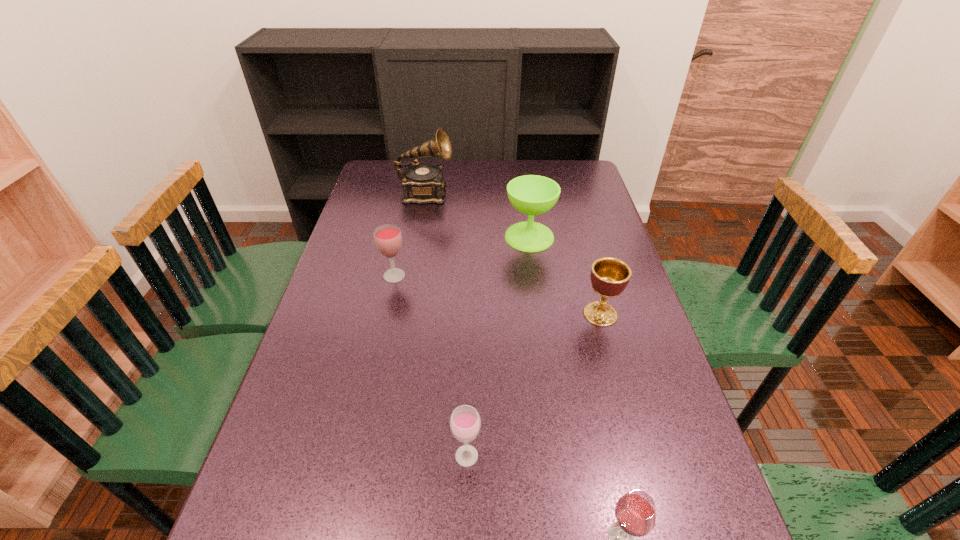
Where is `the tallest object`? The height and width of the screenshot is (540, 960). the tallest object is located at coordinates (422, 183).

At what (x,y) coordinates should I click in order to perform the action: click on the farthest object. Please return your answer as a coordinate pair (x, y). Looking at the image, I should click on (422, 183).

The height and width of the screenshot is (540, 960). In order to click on the fifth nearest object in this screenshot , I will do (x=530, y=194).

The image size is (960, 540). I want to click on the leftmost wineglass, so click(x=388, y=239).

You are a GUI agent. You are given a task and a screenshot of the screen. Output one action in this format:
    pyautogui.click(x=<x>, y=<y>)
    Task: Click on the third farthest object
    The height and width of the screenshot is (540, 960).
    Given the screenshot: What is the action you would take?
    pyautogui.click(x=388, y=239)

Locate an element on the screen. The height and width of the screenshot is (540, 960). the third nearest object is located at coordinates (609, 276).

You are a GUI agent. You are given a task and a screenshot of the screen. Output one action in this format:
    pyautogui.click(x=<x>, y=<y>)
    Task: Click on the fifth farthest object
    This screenshot has width=960, height=540.
    Given the screenshot: What is the action you would take?
    pyautogui.click(x=465, y=423)

Image resolution: width=960 pixels, height=540 pixels. I want to click on the third object from left to right, so click(465, 423).

The height and width of the screenshot is (540, 960). I want to click on vacant space located on the horn of the phonograph record, so click(525, 194).

Find the location of a particular element. Image resolution: width=960 pixels, height=540 pixels. free space located 0.370m on the left of the farthest wineglass is located at coordinates (390, 237).